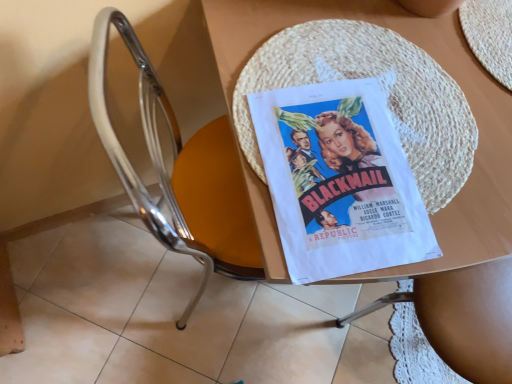
This screenshot has height=384, width=512. What are the coordinates of `free space below metallic chrome chair at center (from a real-world perspective)` in the screenshot? It's located at (195, 277).